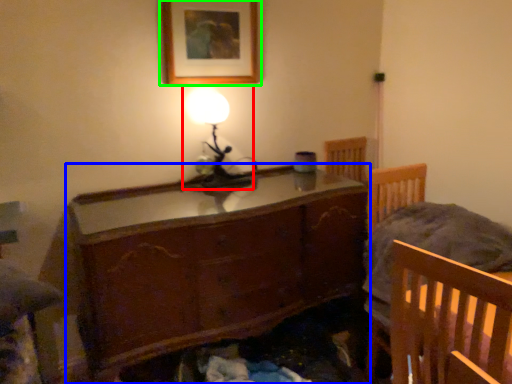
Question: Considering the real-world distances, which object is closest to table lamp (highlighted by a red box)? chest of drawers (highlighted by a blue box) or picture frame (highlighted by a green box).

Choices:
 (A) chest of drawers
 (B) picture frame

Answer: (B)